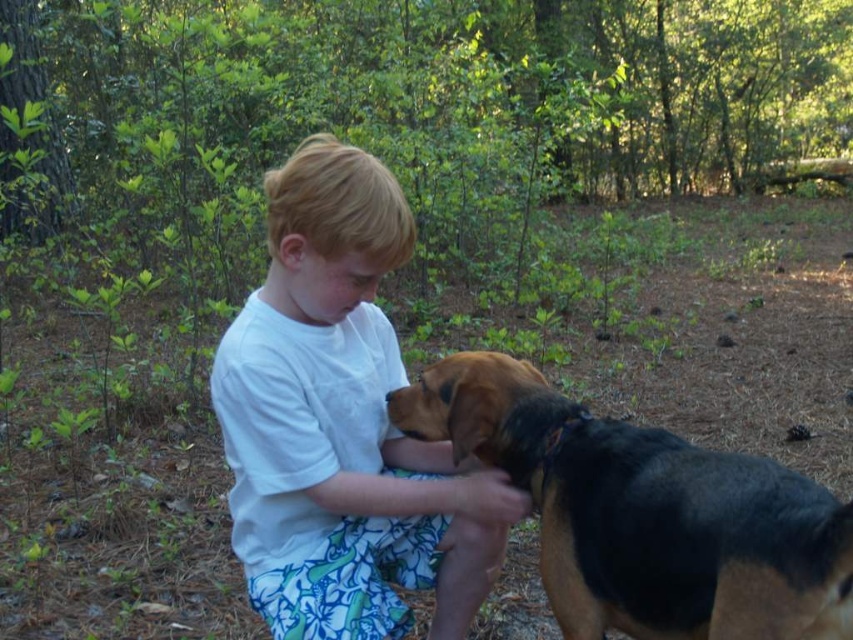
You are a photographer trying to capture a closeup of the white cotton shirt at center. Based on its coordinates, how far to the right and how far up from the bottom should you position your camera?

The white cotton shirt at center is located at coordinates point 0.664 on the horizontal axis and 0.402 on the vertical axis. This means it is 66.4 percent to the right and 40.2 percent up from the bottom of the image.

You are standing in the wooded area and want to walk from point (421, 556) to point (561, 403). Which point will you reach first?

You will reach point (421, 556) first because it is closer to you than point (561, 403), which is further away.